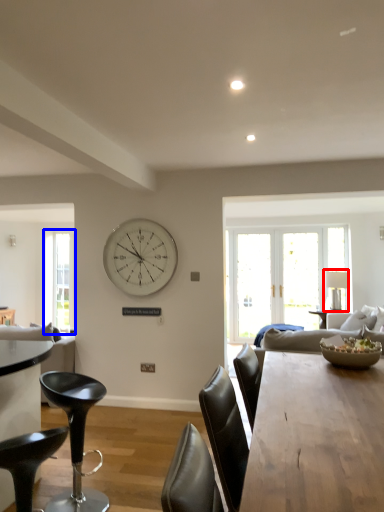
Question: Among these objects, which one is farthest to the camera, lamp (highlighted by a red box) or window (highlighted by a blue box)?

Choices:
 (A) lamp
 (B) window

Answer: (B)